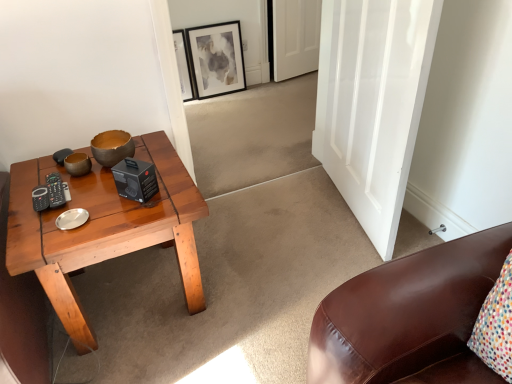
At what (x,y) coordinates should I click in order to perform the action: click on free space above wooden coffee table at left (from a real-world perspective). Please return your answer as a coordinate pair (x, y). Looking at the image, I should click on (75, 192).